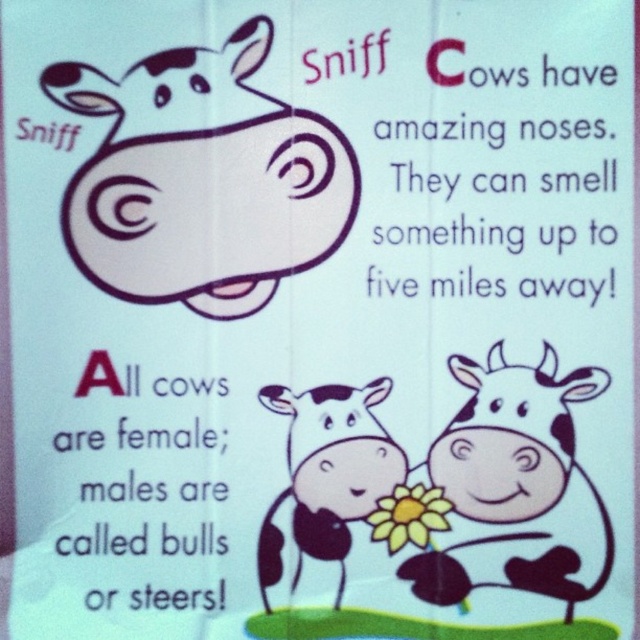
You are looking at the cow illustration and want to read both the black paper text at lower center and the black paper text at upper right. Which one is closer to you?

The black paper text at lower center is closer to you because it is further to the viewer than the black paper text at upper right.

You are designing a poster and need to ensure that the spacing between the black paper text at lower center and the black paper text at upper right is exactly 12 inches. Based on the image provided, is the current spacing sufficient? Please explain.

The distance between the black paper text at lower center and the black paper text at upper right is 13.40 inches, which is more than the required 12 inches. Therefore, the current spacing is sufficient.

You are a child looking at this educational illustration about cows. You see the white spotted cow at lower right and the black and white spotted cow at center. Which cow is placed higher up on the page?

The white spotted cow at lower right is positioned over the black and white spotted cow at center, so it is placed higher up on the page.